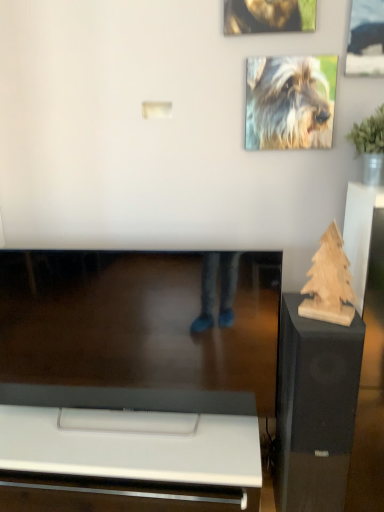
You are a GUI agent. You are given a task and a screenshot of the screen. Output one action in this format:
    pyautogui.click(x=<x>, y=<y>)
    Task: Click on the fluffy fur dog at upper right, which is counted as the first dog, starting from the bottom
    The width and height of the screenshot is (384, 512).
    Given the screenshot: What is the action you would take?
    pyautogui.click(x=290, y=102)

What do you see at coordinates (261, 16) in the screenshot? I see `shiny golden fur at upper center, which ranks as the second dog in bottom-to-top order` at bounding box center [261, 16].

This screenshot has width=384, height=512. In order to click on shiny golden fur at upper center, which ranks as the second dog in bottom-to-top order in this screenshot , I will do `click(261, 16)`.

This screenshot has height=512, width=384. What are the coordinates of `wooden sculpture at right` in the screenshot? It's located at (315, 409).

At what (x,y) coordinates should I click in order to perform the action: click on metallic silver picture frame at upper right. Please return your answer as a coordinate pair (x, y). This screenshot has height=512, width=384. Looking at the image, I should click on (366, 39).

Which of these two, fluffy fur dog at upper right, which is counted as the first dog, starting from the bottom, or wooden sculpture at right, is thinner?

Thinner between the two is fluffy fur dog at upper right, which is counted as the first dog, starting from the bottom.

Is fluffy fur dog at upper right, marked as the second dog in a top-to-bottom arrangement, further to the viewer compared to wooden sculpture at right?

Yes, it is behind wooden sculpture at right.

Between fluffy fur dog at upper right, which is counted as the first dog, starting from the bottom, and wooden sculpture at right, which one has smaller size?

fluffy fur dog at upper right, which is counted as the first dog, starting from the bottom.

Is fluffy fur dog at upper right, which is counted as the first dog, starting from the bottom, inside the boundaries of wooden sculpture at right, or outside?

fluffy fur dog at upper right, which is counted as the first dog, starting from the bottom, exists outside the volume of wooden sculpture at right.

Considering the positions of objects metallic silver picture frame at upper right and shiny golden fur at upper center, which ranks as the second dog in bottom-to-top order, in the image provided, who is more to the right, metallic silver picture frame at upper right or shiny golden fur at upper center, which ranks as the second dog in bottom-to-top order,?

From the viewer's perspective, metallic silver picture frame at upper right appears more on the right side.

Consider the image. How different are the orientations of metallic silver picture frame at upper right and shiny golden fur at upper center, which ranks as the second dog in bottom-to-top order, in degrees?

There is a 0.00134-degree angle between the facing directions of metallic silver picture frame at upper right and shiny golden fur at upper center, which ranks as the second dog in bottom-to-top order.

Does metallic silver picture frame at upper right touch shiny golden fur at upper center, which ranks as the second dog in bottom-to-top order?

No.

Between point (362, 7) and point (233, 26), which one is positioned in front?

Positioned in front is point (362, 7).

How many degrees apart are the facing directions of fluffy fur dog at upper right, marked as the second dog in a top-to-bottom arrangement, and shiny golden fur at upper center, marked as the 1th dog in a top-to-bottom arrangement?

There is a 0.00202-degree angle between the facing directions of fluffy fur dog at upper right, marked as the second dog in a top-to-bottom arrangement, and shiny golden fur at upper center, marked as the 1th dog in a top-to-bottom arrangement.

Considering their positions, is fluffy fur dog at upper right, marked as the second dog in a top-to-bottom arrangement, located in front of or behind shiny golden fur at upper center, which ranks as the second dog in bottom-to-top order?

Visually, fluffy fur dog at upper right, marked as the second dog in a top-to-bottom arrangement, is located behind shiny golden fur at upper center, which ranks as the second dog in bottom-to-top order.

Is fluffy fur dog at upper right, which is counted as the first dog, starting from the bottom, looking in the opposite direction of shiny golden fur at upper center, marked as the 1th dog in a top-to-bottom arrangement?

No, fluffy fur dog at upper right, which is counted as the first dog, starting from the bottom,'s orientation is not away from shiny golden fur at upper center, marked as the 1th dog in a top-to-bottom arrangement.

Does fluffy fur dog at upper right, marked as the second dog in a top-to-bottom arrangement, contain shiny golden fur at upper center, which ranks as the second dog in bottom-to-top order?

No, shiny golden fur at upper center, which ranks as the second dog in bottom-to-top order, is not a part of fluffy fur dog at upper right, marked as the second dog in a top-to-bottom arrangement.

Do you think shiny golden fur at upper center, which ranks as the second dog in bottom-to-top order, is within wooden sculpture at right, or outside of it?

shiny golden fur at upper center, which ranks as the second dog in bottom-to-top order, cannot be found inside wooden sculpture at right.

In the scene shown: Which is in front, shiny golden fur at upper center, which ranks as the second dog in bottom-to-top order, or wooden sculpture at right?

wooden sculpture at right is closer to the camera.

Visually, is shiny golden fur at upper center, marked as the 1th dog in a top-to-bottom arrangement, positioned to the left or to the right of wooden sculpture at right?

In the image, shiny golden fur at upper center, marked as the 1th dog in a top-to-bottom arrangement, appears on the left side of wooden sculpture at right.

Is fluffy fur dog at upper right, which is counted as the first dog, starting from the bottom, positioned far away from metallic silver picture frame at upper right?

No, there isn't a large distance between fluffy fur dog at upper right, which is counted as the first dog, starting from the bottom, and metallic silver picture frame at upper right.

Is fluffy fur dog at upper right, which is counted as the first dog, starting from the bottom, looking in the opposite direction of metallic silver picture frame at upper right?

No, fluffy fur dog at upper right, which is counted as the first dog, starting from the bottom, is not facing the opposite direction of metallic silver picture frame at upper right.

Which is further, (x=318, y=101) or (x=379, y=2)?

Positioned behind is point (x=318, y=101).

Consider the image. Is fluffy fur dog at upper right, which is counted as the first dog, starting from the bottom, at the right side of metallic silver picture frame at upper right?

Incorrect, fluffy fur dog at upper right, which is counted as the first dog, starting from the bottom, is not on the right side of metallic silver picture frame at upper right.

Consider the image. How different are the orientations of metallic silver picture frame at upper right and fluffy fur dog at upper right, which is counted as the first dog, starting from the bottom, in degrees?

metallic silver picture frame at upper right and fluffy fur dog at upper right, which is counted as the first dog, starting from the bottom, are facing 0.000762 degrees away from each other.

Does metallic silver picture frame at upper right have a greater width compared to fluffy fur dog at upper right, which is counted as the first dog, starting from the bottom?

Indeed, metallic silver picture frame at upper right has a greater width compared to fluffy fur dog at upper right, which is counted as the first dog, starting from the bottom.

From the metallic silver picture frame at upper right, count the 1st dog to the left and point to it. Please provide its 2D coordinates.

[(290, 102)]

Which is nearer, (350, 24) or (247, 136)?

Point (350, 24) appears to be closer to the viewer than point (247, 136).

In the scene shown: From a real-world perspective, is metallic silver picture frame at upper right above or below wooden sculpture at right?

metallic silver picture frame at upper right is above wooden sculpture at right.

Locate an element on the screen. The image size is (384, 512). furniture below the metallic silver picture frame at upper right (from the image's perspective) is located at coordinates (315, 409).

From the picture: Which is more distant, (x=367, y=40) or (x=348, y=454)?

Point (x=348, y=454)

In the image, is metallic silver picture frame at upper right positioned in front of or behind wooden sculpture at right?

In the image, metallic silver picture frame at upper right appears behind wooden sculpture at right.

Locate an element on the screen. The width and height of the screenshot is (384, 512). furniture that appears below the fluffy fur dog at upper right, marked as the second dog in a top-to-bottom arrangement (from the image's perspective) is located at coordinates (315, 409).

At what (x,y) coordinates should I click in order to perform the action: click on picture frame that appears in front of the shiny golden fur at upper center, marked as the 1th dog in a top-to-bottom arrangement. Please return your answer as a coordinate pair (x, y). This screenshot has height=512, width=384. Looking at the image, I should click on (366, 39).

Looking at this image, when comparing their distances from metallic silver picture frame at upper right, does wooden sculpture at right or shiny golden fur at upper center, which ranks as the second dog in bottom-to-top order, seem further?

wooden sculpture at right is further to metallic silver picture frame at upper right.

Considering their positions, is metallic silver picture frame at upper right positioned further to fluffy fur dog at upper right, marked as the second dog in a top-to-bottom arrangement, than wooden sculpture at right?

Among the two, wooden sculpture at right is located further to fluffy fur dog at upper right, marked as the second dog in a top-to-bottom arrangement.

Looking at the image, which one is located further to shiny golden fur at upper center, marked as the 1th dog in a top-to-bottom arrangement, metallic silver picture frame at upper right or fluffy fur dog at upper right, which is counted as the first dog, starting from the bottom?

metallic silver picture frame at upper right lies further to shiny golden fur at upper center, marked as the 1th dog in a top-to-bottom arrangement, than the other object.

Estimate the real-world distances between objects in this image. Which object is further from wooden sculpture at right, shiny golden fur at upper center, which ranks as the second dog in bottom-to-top order, or metallic silver picture frame at upper right?

shiny golden fur at upper center, which ranks as the second dog in bottom-to-top order, is positioned further to the anchor wooden sculpture at right.

From the image, which object appears to be nearer to wooden sculpture at right, metallic silver picture frame at upper right or fluffy fur dog at upper right, marked as the second dog in a top-to-bottom arrangement?

fluffy fur dog at upper right, marked as the second dog in a top-to-bottom arrangement, lies closer to wooden sculpture at right than the other object.

Based on their spatial positions, is metallic silver picture frame at upper right or shiny golden fur at upper center, marked as the 1th dog in a top-to-bottom arrangement, closer to wooden sculpture at right?

metallic silver picture frame at upper right.

Based on their spatial positions, is fluffy fur dog at upper right, marked as the second dog in a top-to-bottom arrangement, or shiny golden fur at upper center, which ranks as the second dog in bottom-to-top order, closer to wooden sculpture at right?

fluffy fur dog at upper right, marked as the second dog in a top-to-bottom arrangement.

Considering their positions, is shiny golden fur at upper center, marked as the 1th dog in a top-to-bottom arrangement, positioned closer to fluffy fur dog at upper right, which is counted as the first dog, starting from the bottom, than wooden sculpture at right?

shiny golden fur at upper center, marked as the 1th dog in a top-to-bottom arrangement, is positioned closer to the anchor fluffy fur dog at upper right, which is counted as the first dog, starting from the bottom.

You are a GUI agent. You are given a task and a screenshot of the screen. Output one action in this format:
    pyautogui.click(x=<x>, y=<y>)
    Task: Click on the picture frame between shiny golden fur at upper center, which ranks as the second dog in bottom-to-top order, and wooden sculpture at right in the up-down direction
    The height and width of the screenshot is (512, 384).
    Given the screenshot: What is the action you would take?
    pyautogui.click(x=366, y=39)

I want to click on dog that lies between metallic silver picture frame at upper right and wooden sculpture at right from top to bottom, so click(x=290, y=102).

At what (x,y) coordinates should I click in order to perform the action: click on dog located between shiny golden fur at upper center, which ranks as the second dog in bottom-to-top order, and metallic silver picture frame at upper right in the left-right direction. Please return your answer as a coordinate pair (x, y). Looking at the image, I should click on (290, 102).

Identify the location of dog between shiny golden fur at upper center, marked as the 1th dog in a top-to-bottom arrangement, and wooden sculpture at right vertically. (290, 102).